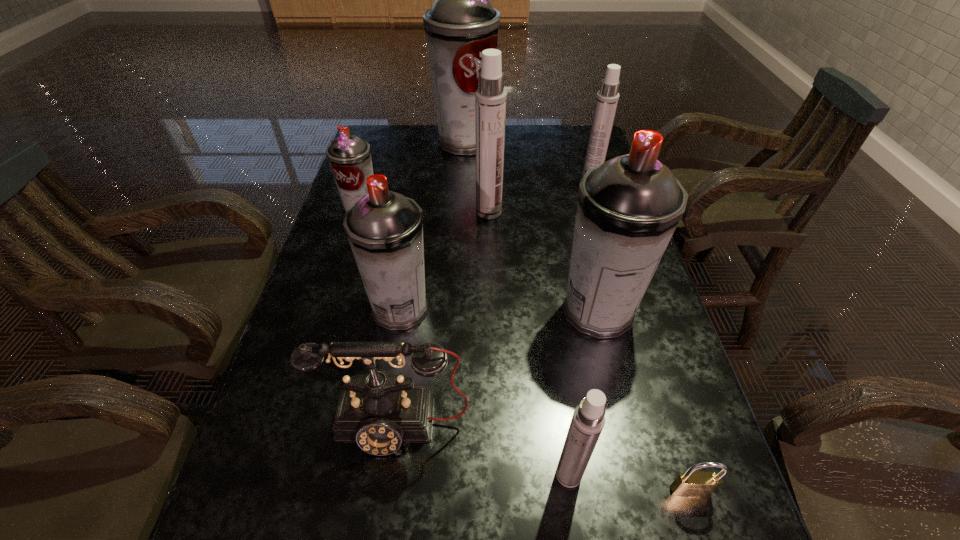
Locate an element on the screen. the second closest object relative to the second farthest object is located at coordinates (462, 23).

Identify which aerosol can is located as the sixth nearest to the second smallest gray aerosol can. Please provide its 2D coordinates. Your answer should be formatted as a tuple, i.e. [(x, y)], where the tuple contains the x and y coordinates of a point satisfying the conditions above.

[(607, 98)]

Locate which aerosol can is the third closest to the third biggest gray aerosol can. Please provide its 2D coordinates. Your answer should be formatted as a tuple, i.e. [(x, y)], where the tuple contains the x and y coordinates of a point satisfying the conditions above.

[(628, 208)]

Select which gray aerosol can appears as the third closest to the second smallest gray aerosol can. Please provide its 2D coordinates. Your answer should be formatted as a tuple, i.e. [(x, y)], where the tuple contains the x and y coordinates of a point satisfying the conditions above.

[(462, 23)]

Locate an element on the screen. the second closest gray aerosol can relative to the leftmost aerosol can is located at coordinates (462, 23).

Point out which white aerosol can is positioned as the nearest to the fourth object from right to left. Please provide its 2D coordinates. Your answer should be formatted as a tuple, i.e. [(x, y)], where the tuple contains the x and y coordinates of a point satisfying the conditions above.

[(490, 98)]

The image size is (960, 540). Identify the location of white aerosol can that is the third closest to the telephone. (607, 98).